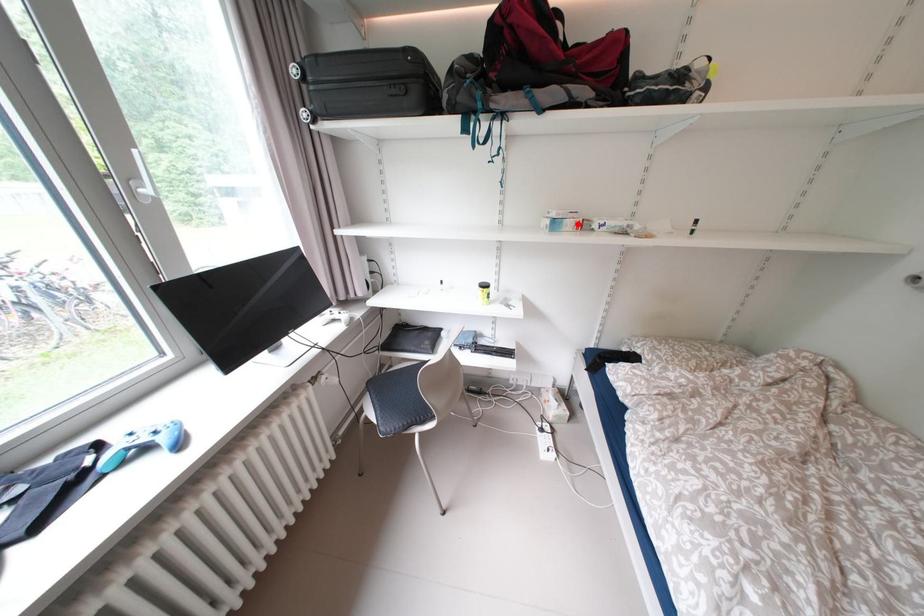
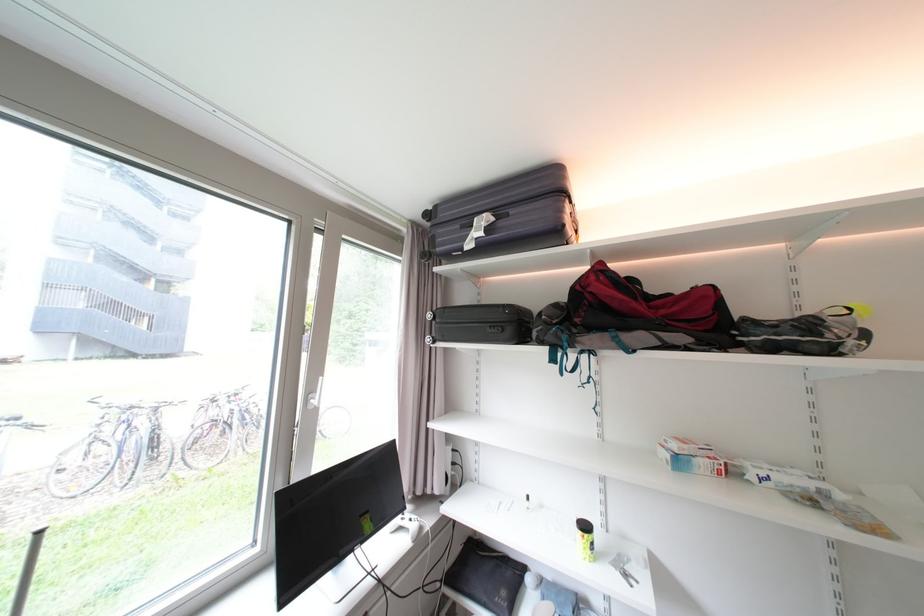
In the second image, find the point that corresponds to the highlighted location in the first image.

(711, 464)